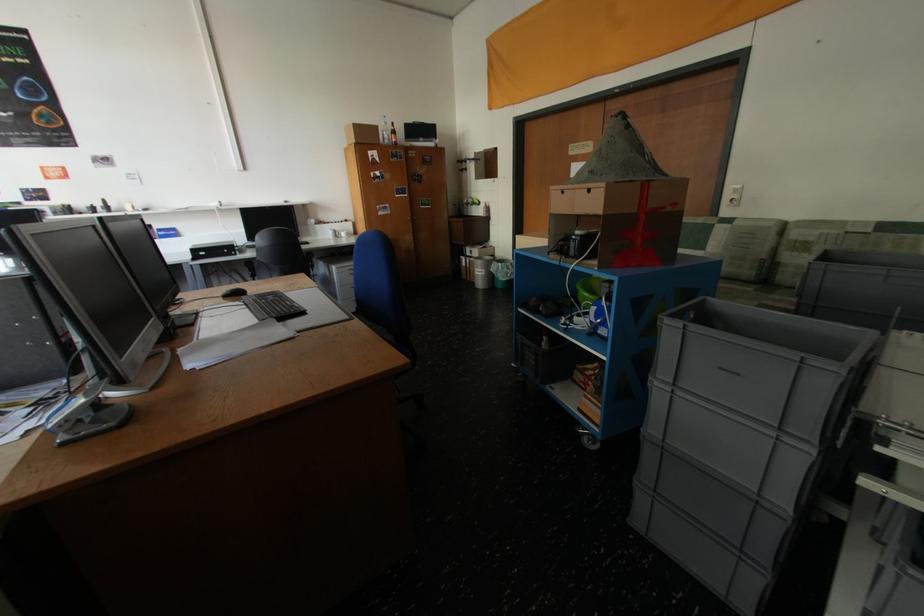
Find where to press the hole puncher handle. Please return your answer as a coordinate pair (x, y).

(590, 408)